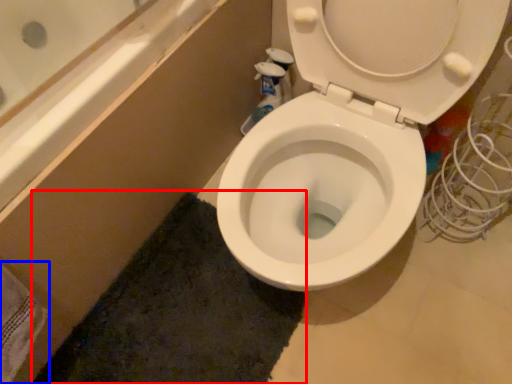
Question: Which point is closer to the camera, bath mat (highlighted by a red box) or bath towel (highlighted by a blue box)?

Choices:
 (A) bath mat
 (B) bath towel

Answer: (B)